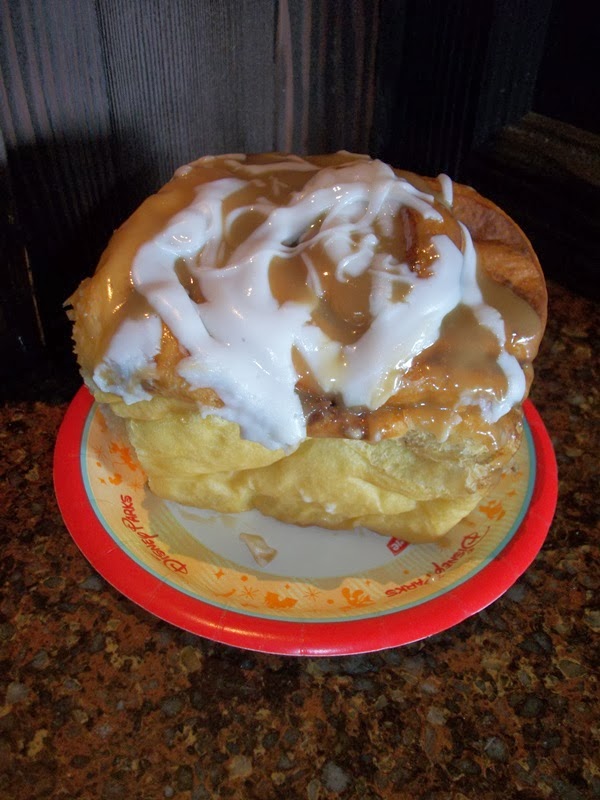
This screenshot has width=600, height=800. What are the coordinates of `brown, light brown, white granite table` in the screenshot? It's located at (204, 708).